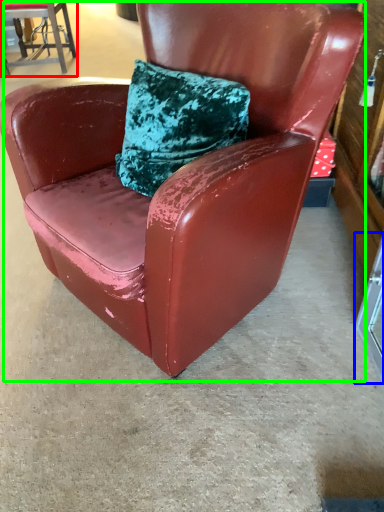
Question: Which is nearer to the chair (highlighted by a red box)? glass door (highlighted by a blue box) or chair (highlighted by a green box).

Choices:
 (A) glass door
 (B) chair

Answer: (B)